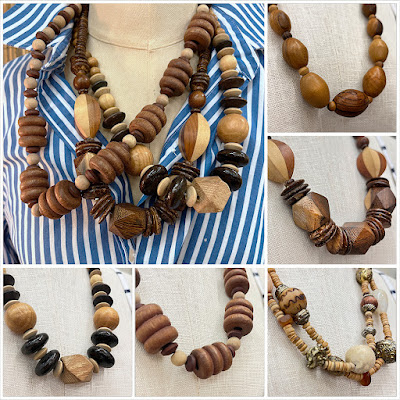
Locate an element on the screen. small square picture is located at coordinates (68, 337), (195, 321), (335, 323), (339, 182), (328, 64).